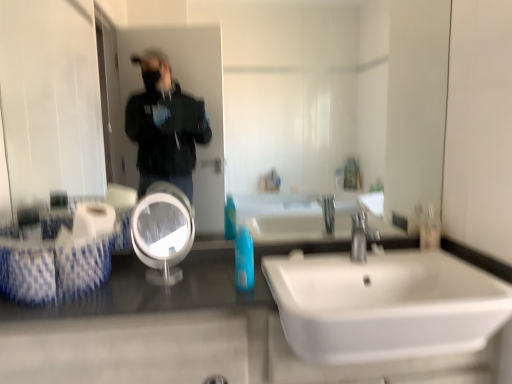
Question: Considering the positions of blue glossy mouthwash at center, marked as the second mouthwash in a right-to-left arrangement, and clear glass mirror at center in the image, is blue glossy mouthwash at center, marked as the second mouthwash in a right-to-left arrangement, bigger or smaller than clear glass mirror at center?

Choices:
 (A) big
 (B) small

Answer: (B)

Question: Considering the positions of point (246, 253) and point (241, 109), is point (246, 253) closer or farther from the camera than point (241, 109)?

Choices:
 (A) closer
 (B) farther

Answer: (A)

Question: Which of these objects is positioned closest to the satin nickel faucet at center?

Choices:
 (A) blue glossy mouthwash at center, marked as the second mouthwash in a right-to-left arrangement
 (B) white glossy mirror at center
 (C) shiny granite counter at lower left
 (D) clear plastic bottle at right, which is counted as the first mouthwash, starting from the back
 (E) clear glass mirror at center

Answer: (D)

Question: Which of these objects is positioned closest to the clear glass mirror at center?

Choices:
 (A) satin nickel faucet at center
 (B) clear plastic bottle at right, which is counted as the 2th mouthwash, starting from the front
 (C) blue glossy mouthwash at center, the second mouthwash in the back-to-front sequence
 (D) shiny granite counter at lower left
 (E) white ceramic sink at lower right

Answer: (E)